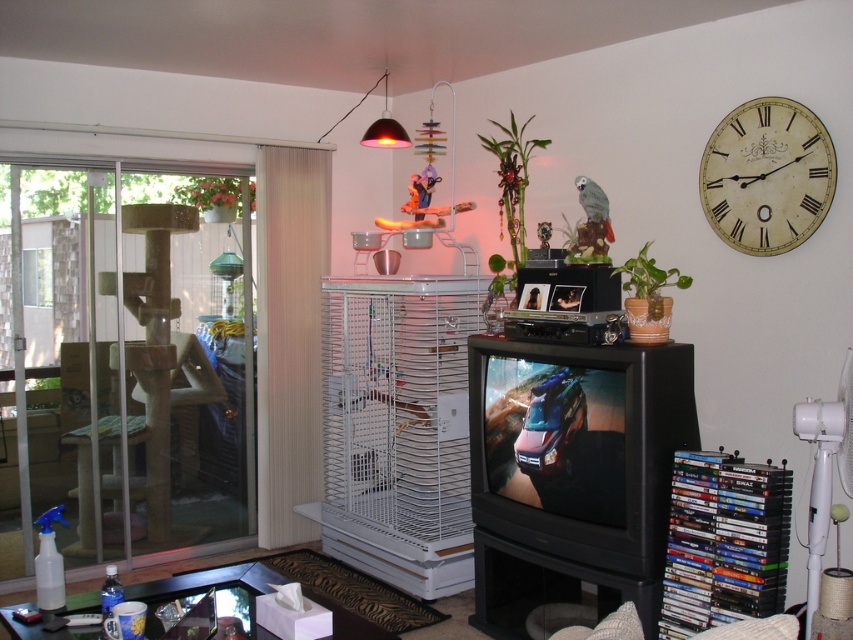
Question: Observing the image, what is the correct spatial positioning of clear glass door at left in reference to clear glass screen door at left?

Choices:
 (A) above
 (B) below

Answer: (A)

Question: Which object appears farthest from the camera in this image?

Choices:
 (A) ivory/off-white/smooth clock at upper right
 (B) clear glass door at left
 (C) black plastic television at lower right

Answer: (B)

Question: Which of the following is the closest to the observer?

Choices:
 (A) clear glass door at left
 (B) ivory/off-white/smooth clock at upper right
 (C) clear glass screen door at left
 (D) black plastic television at lower right

Answer: (D)

Question: Can you confirm if clear glass screen door at left is wider than ivory/off-white/smooth clock at upper right?

Choices:
 (A) yes
 (B) no

Answer: (A)

Question: Is clear glass door at left thinner than black plastic television at lower right?

Choices:
 (A) yes
 (B) no

Answer: (B)

Question: Which of the following is the closest to the observer?

Choices:
 (A) (45, 452)
 (B) (775, 157)

Answer: (B)